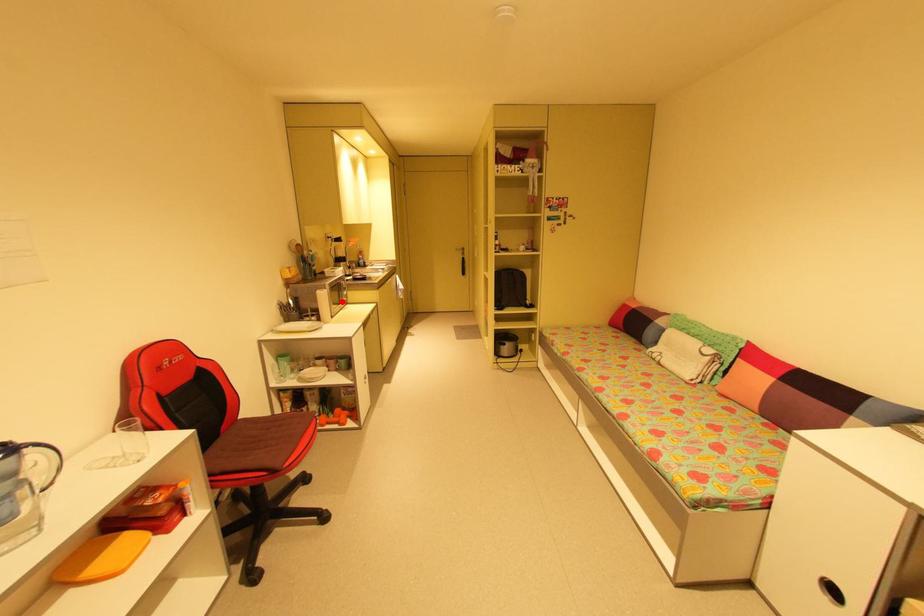
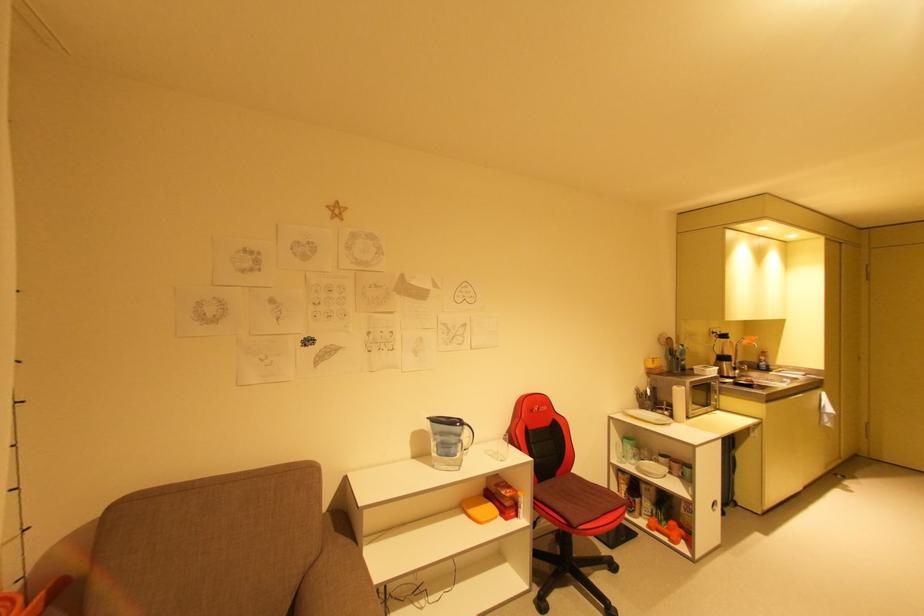
Question: I am providing you with two images of the same scene from different viewpoints. Given a red point in image1, look at the same physical point in image2. Is it:

Choices:
 (A) Closer to the viewpoint
 (B) Farther from the viewpoint

Answer: (B)